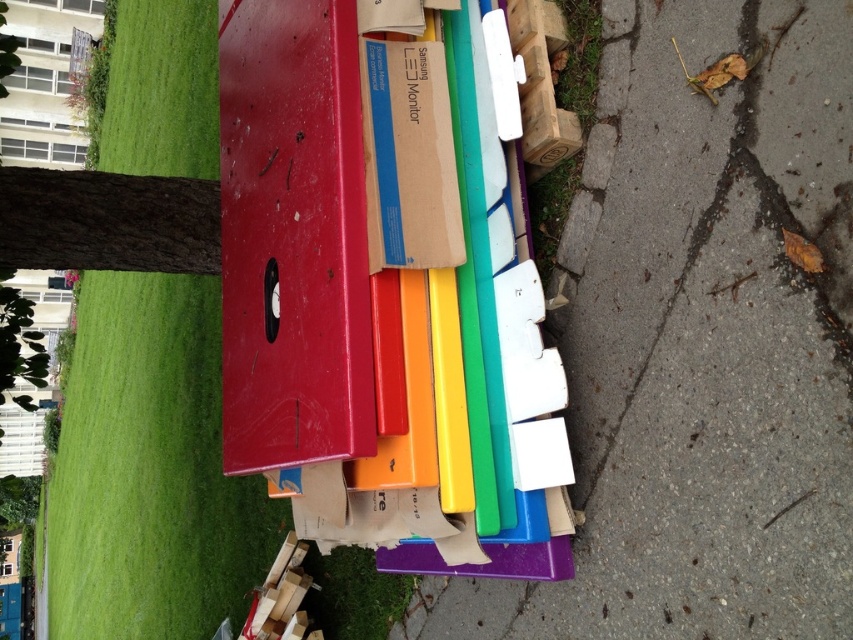
You are standing in a park and see the cardboard samsung monitor at center and the green grass at left. Which object is closer to you?

The green grass at left is closer to you because the cardboard samsung monitor at center is behind it.

You are standing in front of the stack of colorful plastic items and need to reach a point that is closer to you. Which point should you choose, point (91, 492) or point (386, 58)?

Point (91, 492) is further to the camera than point (386, 58), so the closer point to you is point (386, 58).

You are planning to set up a picnic area and have a picnic blanket that covers an area of 2 square meters. Based on the scene, which location between the smooth concrete pavement at right and the green grass at left would be more suitable for placing your picnic blanket?

The green grass at left is more suitable because it has a larger area than the smooth concrete pavement at right, which is smaller in size.